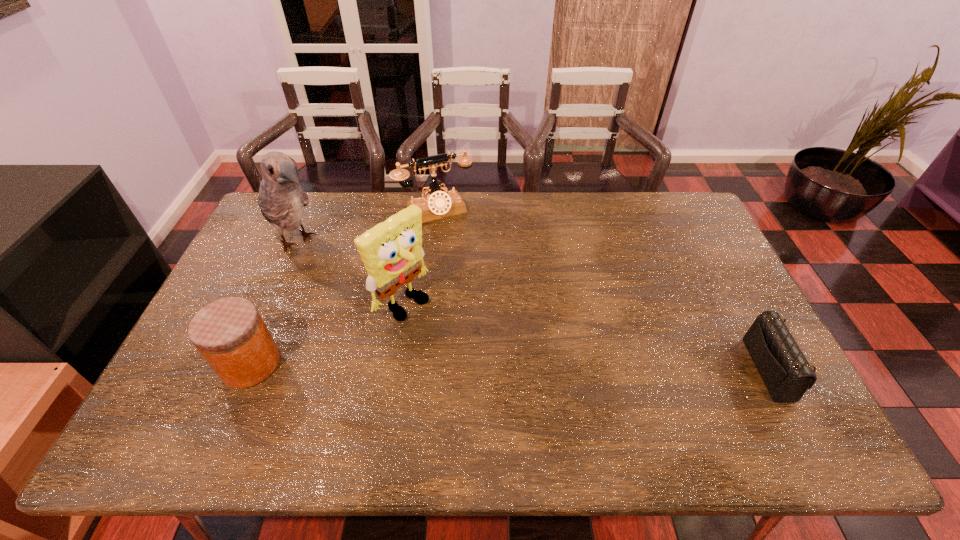
This screenshot has width=960, height=540. I want to click on clutch bag that is at the near edge, so click(x=786, y=373).

Find the location of `jar that is at the left edge`. jar that is at the left edge is located at coordinates (230, 334).

The width and height of the screenshot is (960, 540). Identify the location of parrot that is at the left edge. (282, 199).

The width and height of the screenshot is (960, 540). Find the location of `object present at the right edge`. object present at the right edge is located at coordinates (786, 373).

What are the coordinates of `object that is positioned at the far left corner` in the screenshot? It's located at (282, 199).

Image resolution: width=960 pixels, height=540 pixels. Identify the location of object that is positioned at the near left corner. (230, 334).

This screenshot has height=540, width=960. I want to click on object located in the near right corner section of the desktop, so click(x=786, y=373).

Image resolution: width=960 pixels, height=540 pixels. Identify the location of vacant space at the far edge. (487, 217).

Identify the location of vacant space at the near edge of the desktop. This screenshot has height=540, width=960. (478, 400).

Locate an element on the screen. blank space at the right edge of the desktop is located at coordinates (720, 318).